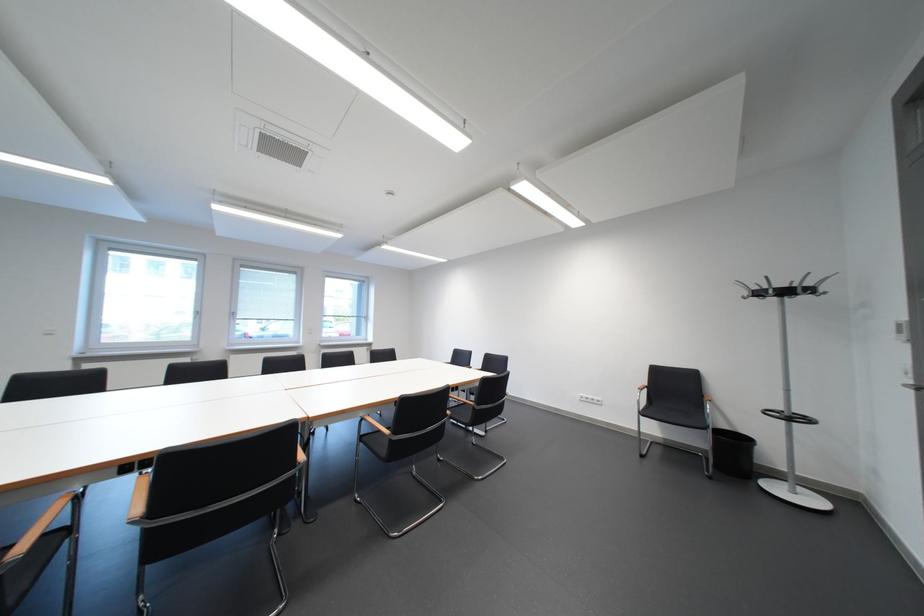
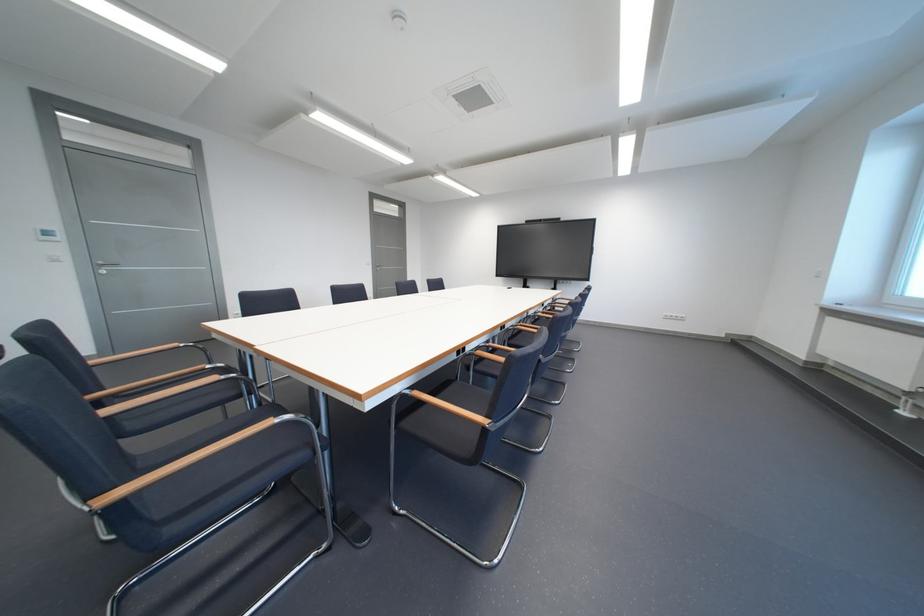
Question: I am providing you with two images of the same scene from different viewpoints. After the viewpoint changes to image2, which objects are now occluded?

Choices:
 (A) black chair sitting surface
 (B) white light switch
 (C) wooden chair armrest
 (D) plastic bottle

Answer: (A)